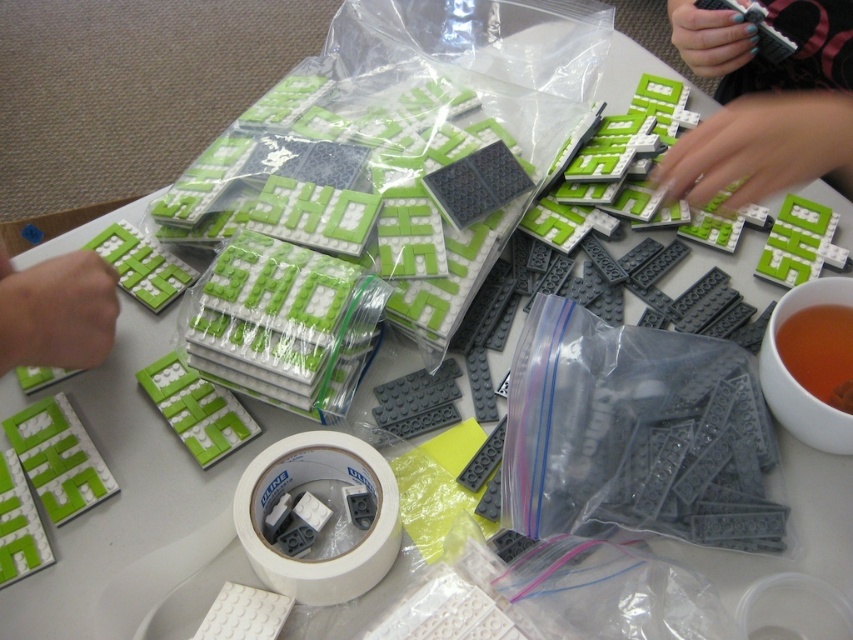
Question: Considering the real-world distances, which object is closest to the green matte lego brick at upper right?

Choices:
 (A) matte green plastic lego at lower left
 (B) brown liquid at lower right

Answer: (B)

Question: Can you confirm if green matte lego brick at upper right is bigger than brown liquid at lower right?

Choices:
 (A) no
 (B) yes

Answer: (B)

Question: Among these points, which one is nearest to the camera?

Choices:
 (A) tap(50, 360)
 (B) tap(697, 68)
 (C) tap(775, 346)

Answer: (A)

Question: Is matte green plastic lego at lower left positioned in front of brown liquid at lower right?

Choices:
 (A) no
 (B) yes

Answer: (B)

Question: Is matte green plastic lego at lower left to the right of brown liquid at lower right from the viewer's perspective?

Choices:
 (A) no
 (B) yes

Answer: (A)

Question: Estimate the real-world distances between objects in this image. Which object is farther from the green matte lego brick at upper right?

Choices:
 (A) matte green plastic lego at lower left
 (B) brown liquid at lower right

Answer: (A)